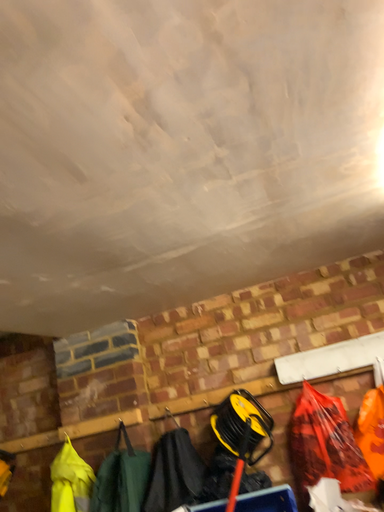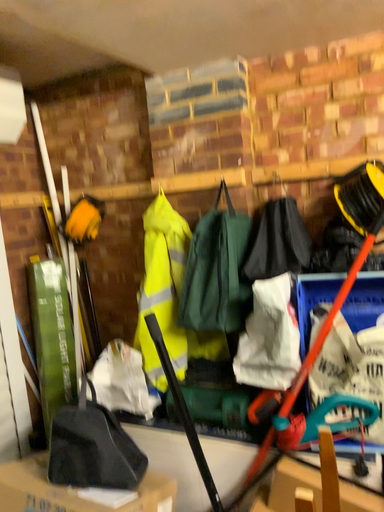
Question: How did the camera likely rotate when shooting the video?

Choices:
 (A) rotated right
 (B) rotated left

Answer: (B)